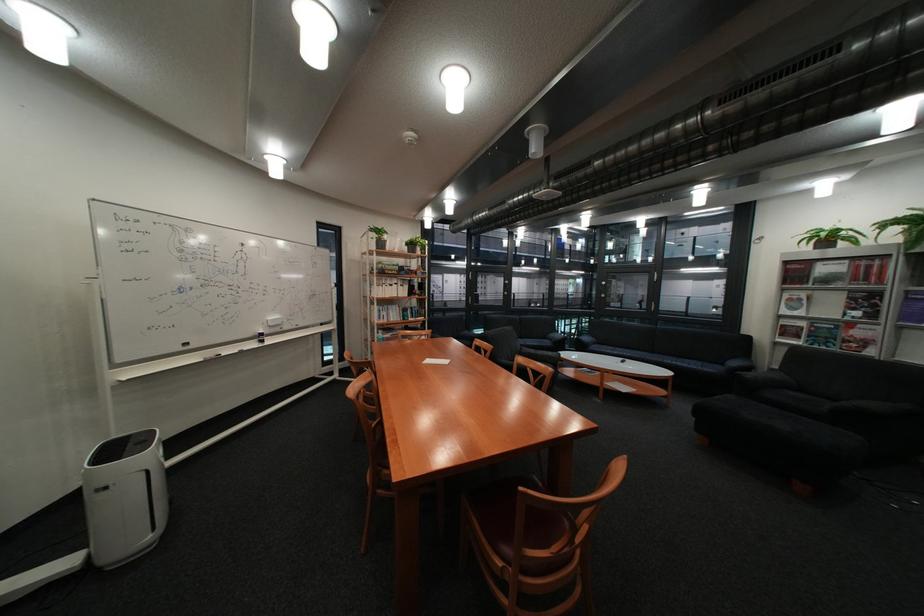
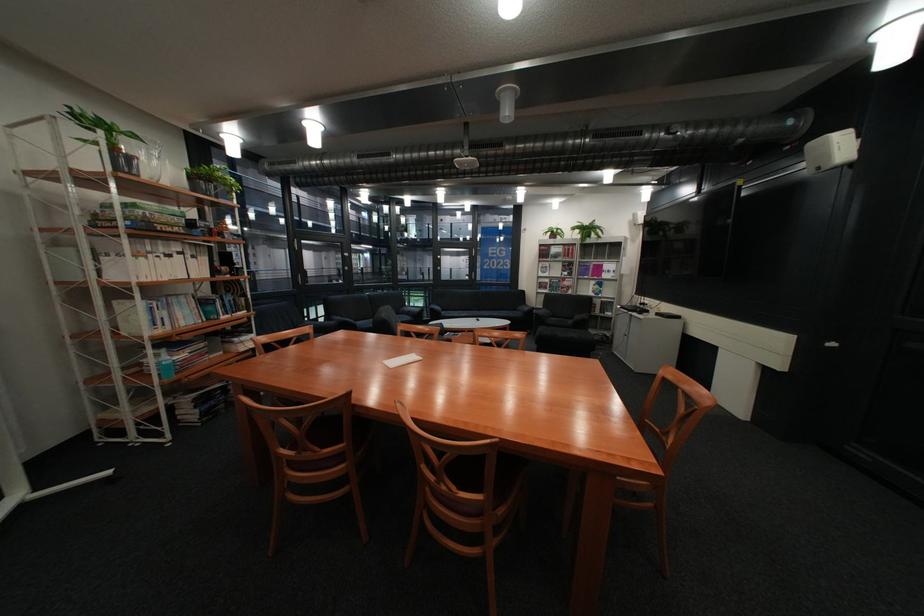
The point at [737,363] is marked in the first image. Where is the corresponding point in the second image?

(531, 310)